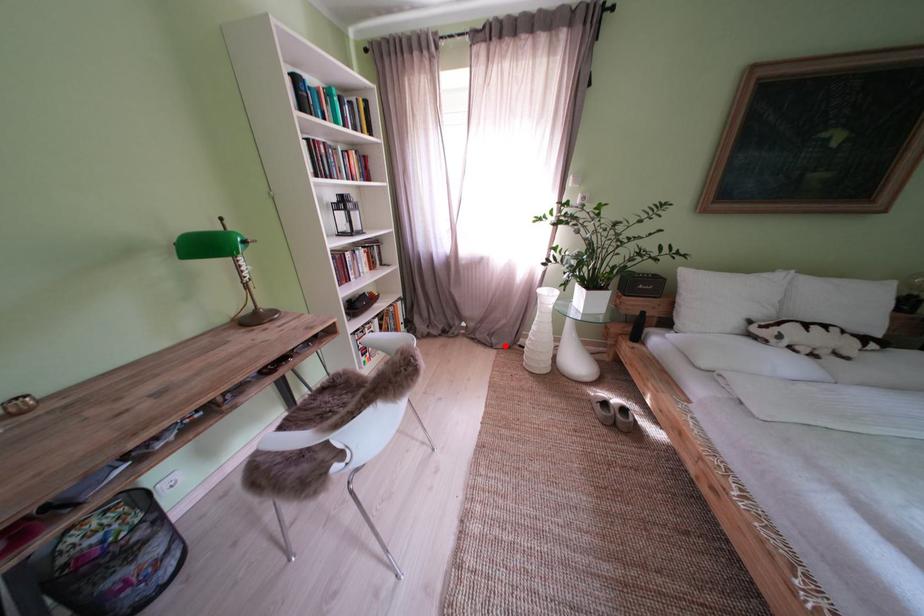
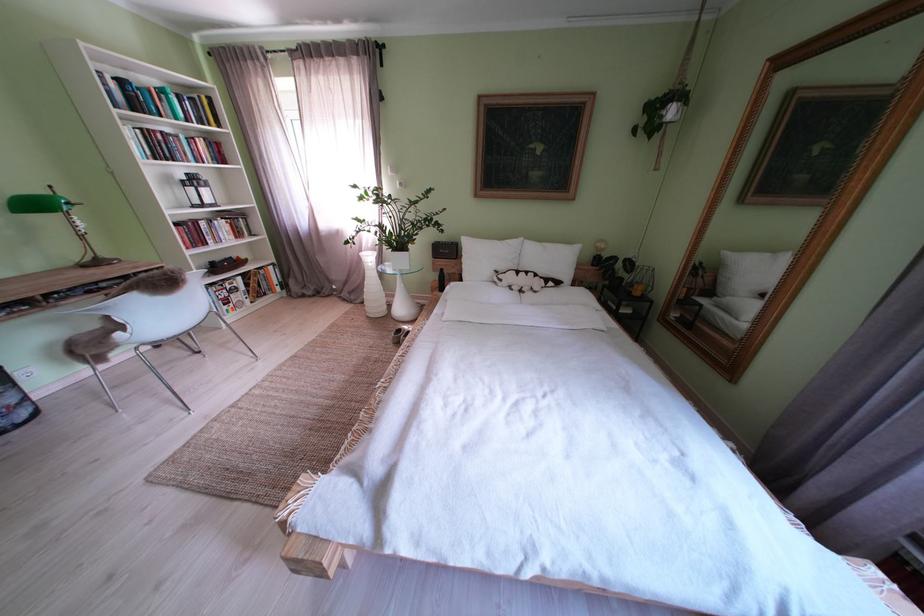
Question: I am providing you with two images of the same scene from different viewpoints. A red point is marked on the first image. At the location where the point appears in image 1, is it still visible in image 2?

Choices:
 (A) Yes
 (B) No

Answer: (A)